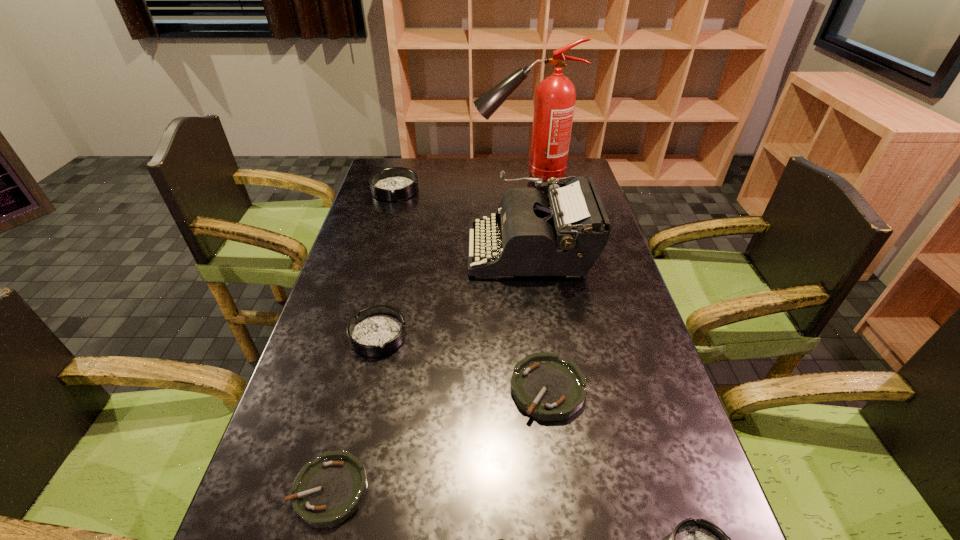
Find the location of a particular element. The width and height of the screenshot is (960, 540). the leftmost green ashtray is located at coordinates (328, 490).

In order to click on the second biggest green ashtray in this screenshot , I will do `click(328, 490)`.

In order to click on vacant space located 0.170m at the nozzle end of the red fire extinguisher in this screenshot , I will do `click(431, 177)`.

Identify the location of free space located 0.340m at the nozzle end of the red fire extinguisher. (389, 177).

The width and height of the screenshot is (960, 540). Identify the location of vacant region located at the nozzle end of the red fire extinguisher. (451, 177).

At what (x,y) coordinates should I click in order to perform the action: click on free region located 0.350m on the front-facing side of the second tallest object. Please return your answer as a coordinate pair (x, y). Image resolution: width=960 pixels, height=540 pixels. Looking at the image, I should click on (358, 250).

You are a GUI agent. You are given a task and a screenshot of the screen. Output one action in this format:
    pyautogui.click(x=<x>, y=<y>)
    Task: Click on the free point located 0.260m on the front-facing side of the second tallest object
    The width and height of the screenshot is (960, 540).
    Given the screenshot: What is the action you would take?
    pyautogui.click(x=387, y=250)

Identify the location of free space located 0.180m on the front-facing side of the second tallest object. (412, 250).

Find the location of a particular element. vacant space located on the back of the farthest ashtray is located at coordinates (403, 160).

The width and height of the screenshot is (960, 540). Find the location of `vacant space located on the right of the fourth farthest object`. vacant space located on the right of the fourth farthest object is located at coordinates [x=465, y=336].